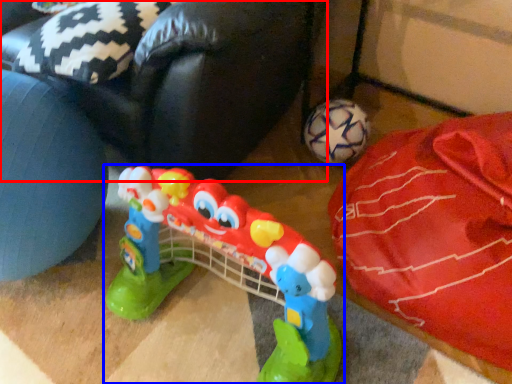
Question: Among these objects, which one is nearest to the camera, bean bag chair (highlighted by a red box) or toy (highlighted by a blue box)?

Choices:
 (A) bean bag chair
 (B) toy

Answer: (B)